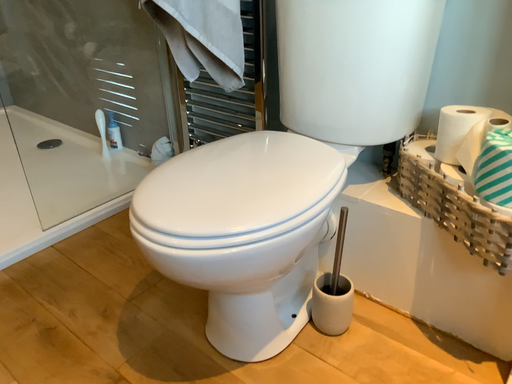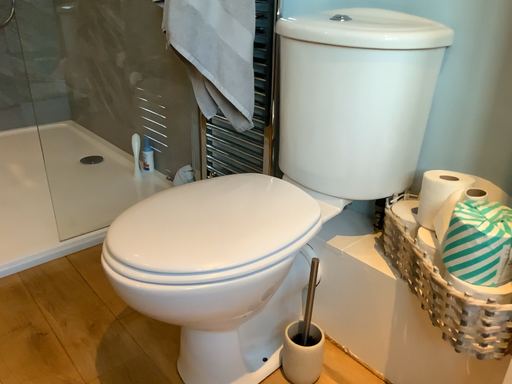
Question: How did the camera likely rotate when shooting the video?

Choices:
 (A) rotated left
 (B) rotated right

Answer: (A)